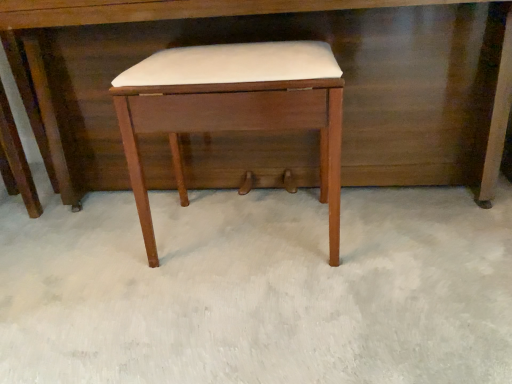
Where is `vacant region to the left of white leather stool at center`? This screenshot has width=512, height=384. vacant region to the left of white leather stool at center is located at coordinates (98, 266).